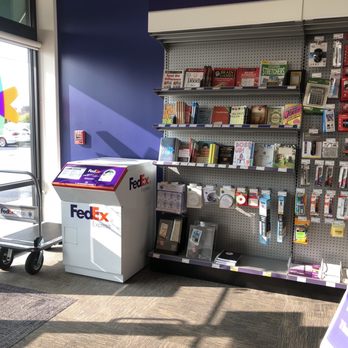
Locate an element on the screen. The height and width of the screenshot is (348, 348). mat is located at coordinates (17, 298).